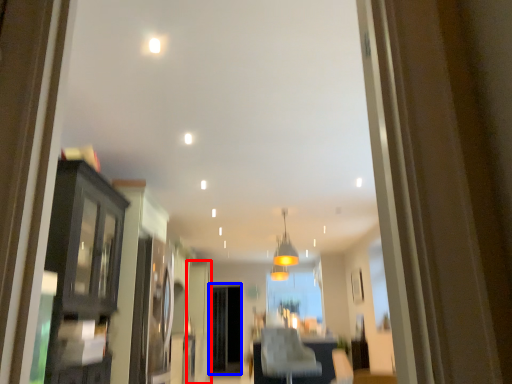
Question: Which of the following is the farthest to the observer, door (highlighted by a red box) or screen door (highlighted by a blue box)?

Choices:
 (A) door
 (B) screen door

Answer: (B)